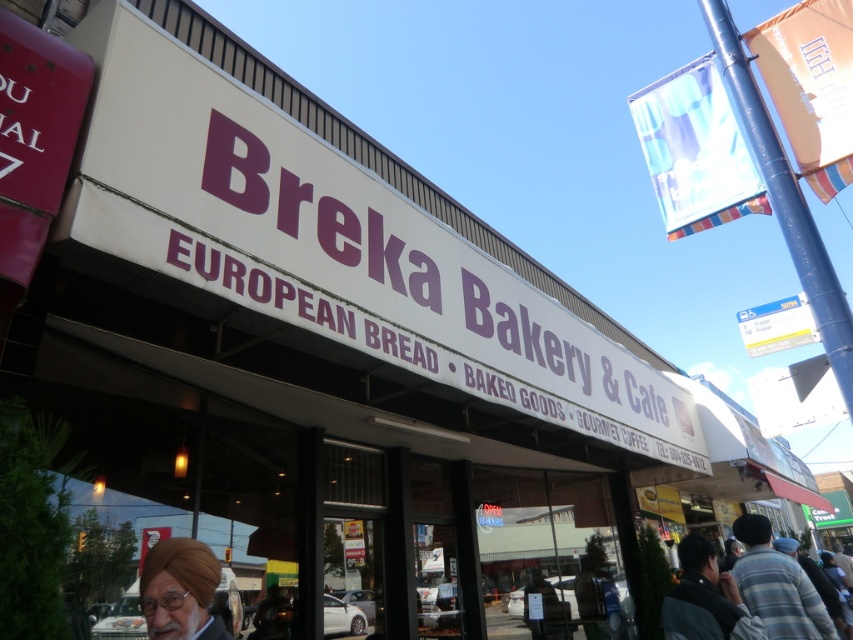
You are a customer standing outside the Breka Bakery storefront and see the striped cotton shirt at lower right and the matte brown turban at lower left. Which item is closer to you?

The striped cotton shirt at lower right is closer to you because it is further to the viewer than the matte brown turban at lower left.

You are a customer standing outside the Breka Bakery storefront. You notice two items displayed on a rack at the lower right corner of the image. The items are the striped cotton shirt at lower right and the dark gray jacket at lower right. Which item is shorter in height?

The striped cotton shirt at lower right has a lesser height compared to the dark gray jacket at lower right, so the striped cotton shirt at lower right is shorter in height.